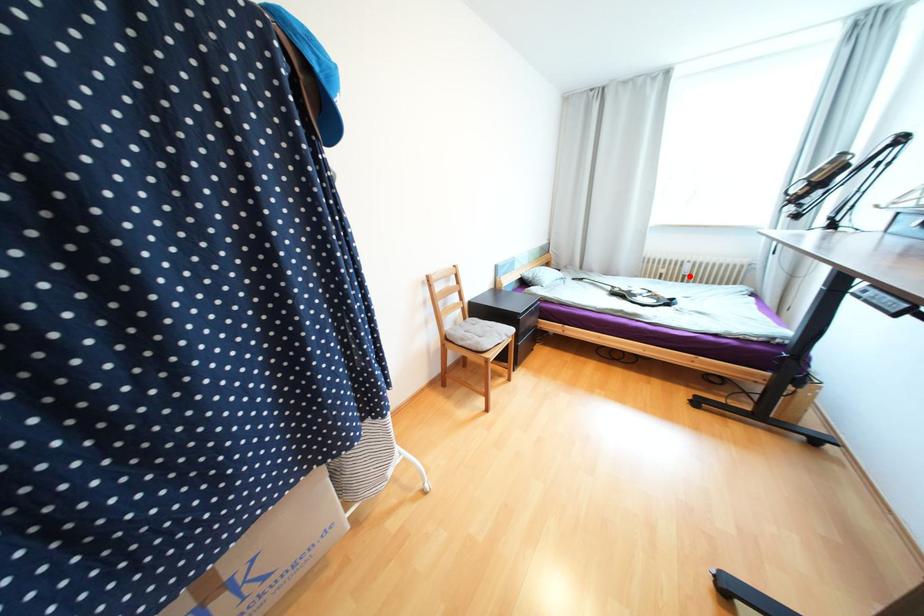
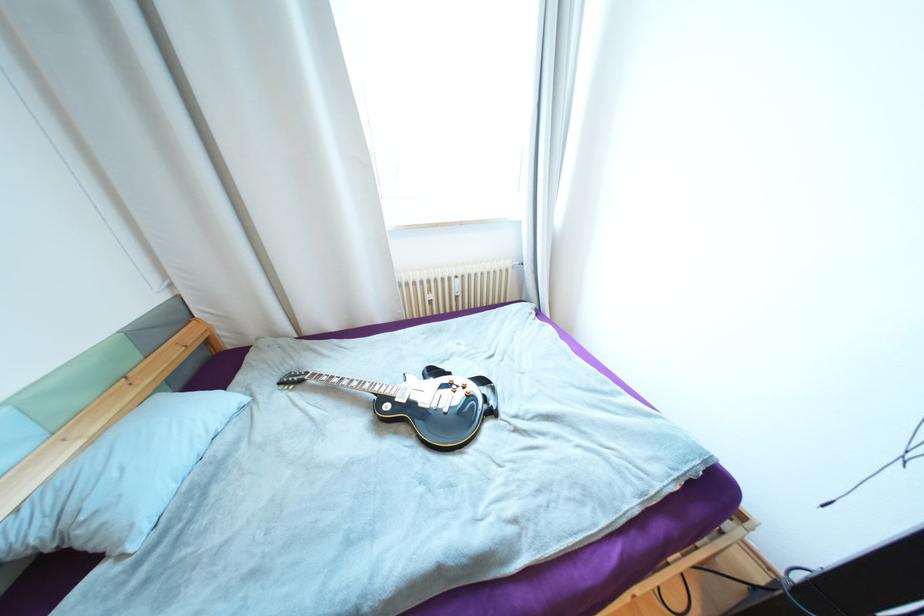
Locate, in the second image, the point that corresponds to the highlighted location in the first image.

(463, 297)